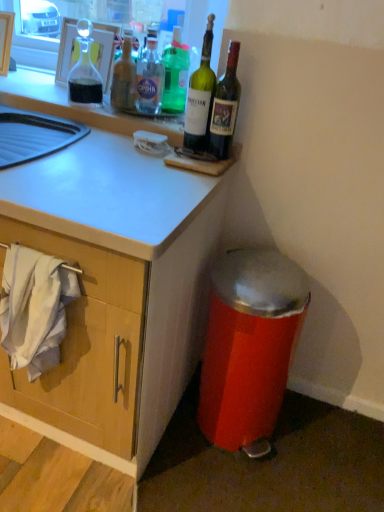
Question: From the image's perspective, relative to clear glass bottle at upper center, the 4th bottle when ordered from right to left, is white fabric at lower left above or below?

Choices:
 (A) below
 (B) above

Answer: (A)

Question: Based on their sizes in the image, would you say white fabric at lower left is bigger or smaller than clear glass bottle at upper center, the 4th bottle when ordered from right to left?

Choices:
 (A) big
 (B) small

Answer: (A)

Question: Based on their relative distances, which object is nearer to the white fabric at lower left?

Choices:
 (A) metallic red trash can at lower right
 (B) green glass bottle at upper right, the fifth bottle from the left
 (C) green glass bottle at upper center, positioned as the third bottle in left-to-right order
 (D) clear glass carafe at upper left
 (E) translucent glass bottle at upper center, acting as the fifth bottle starting from the right

Answer: (A)

Question: Which object is the farthest from the translucent glass bottle at upper center, acting as the fifth bottle starting from the right?

Choices:
 (A) white glossy sink at upper left
 (B) green glass bottle at upper center, the 4th bottle positioned from the left
 (C) green glass bottle at upper center, positioned as the 3th bottle in right-to-left order
 (D) clear glass carafe at upper left
 (E) clear glass bottle at upper center, the 4th bottle when ordered from right to left

Answer: (B)